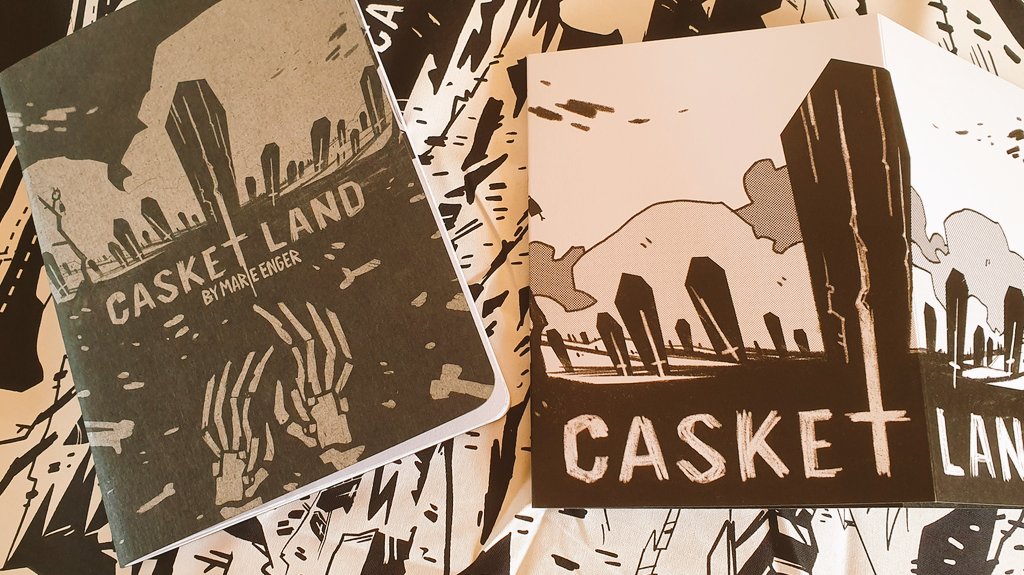
Locate an element on the screen. surface is located at coordinates (469, 68).